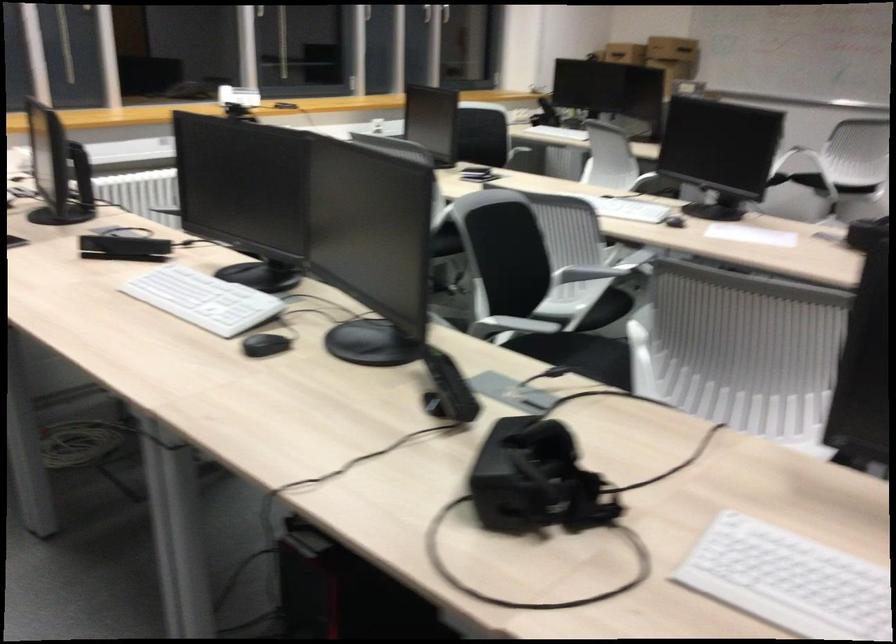
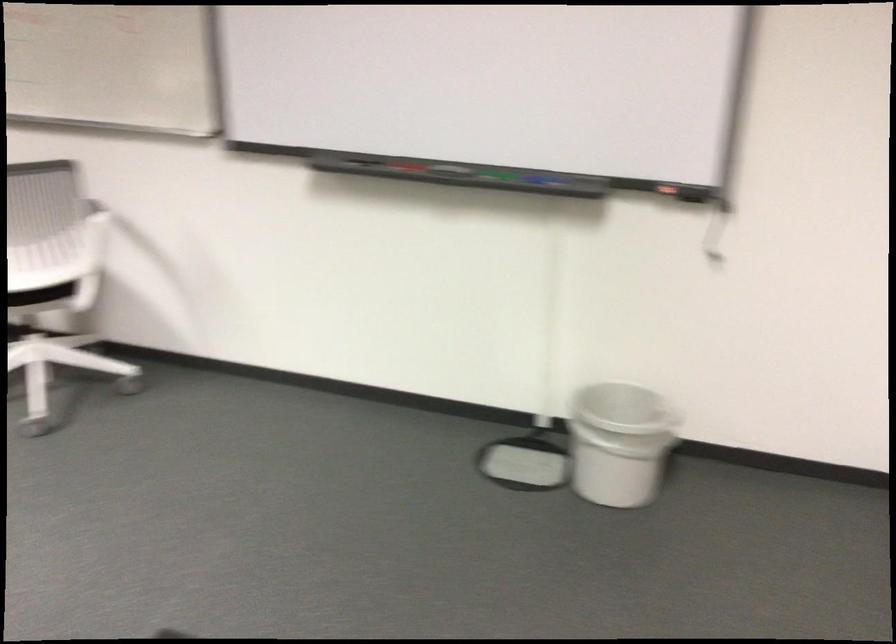
The images are taken continuously from a first-person perspective. In which direction are you moving?

The movement direction of the cameraman is right, forward.